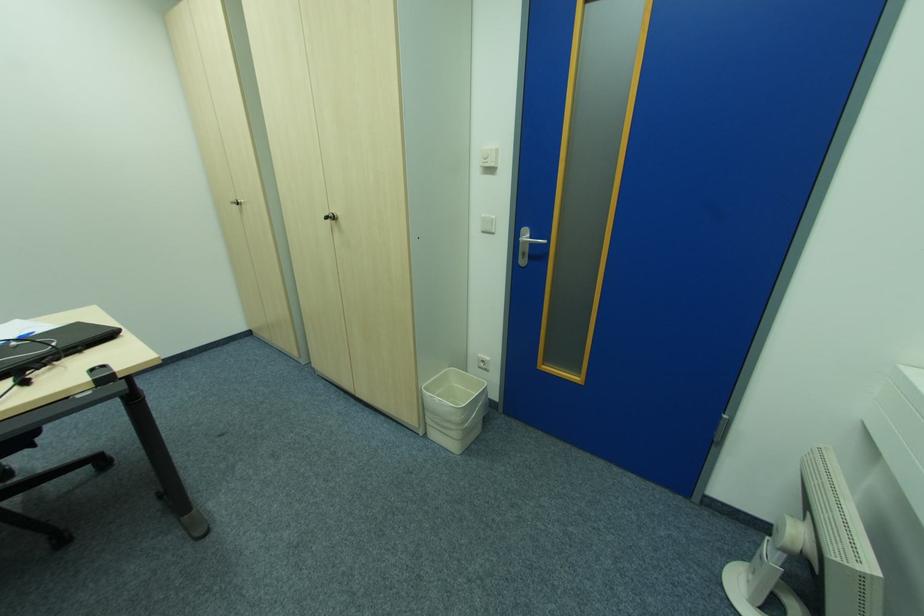
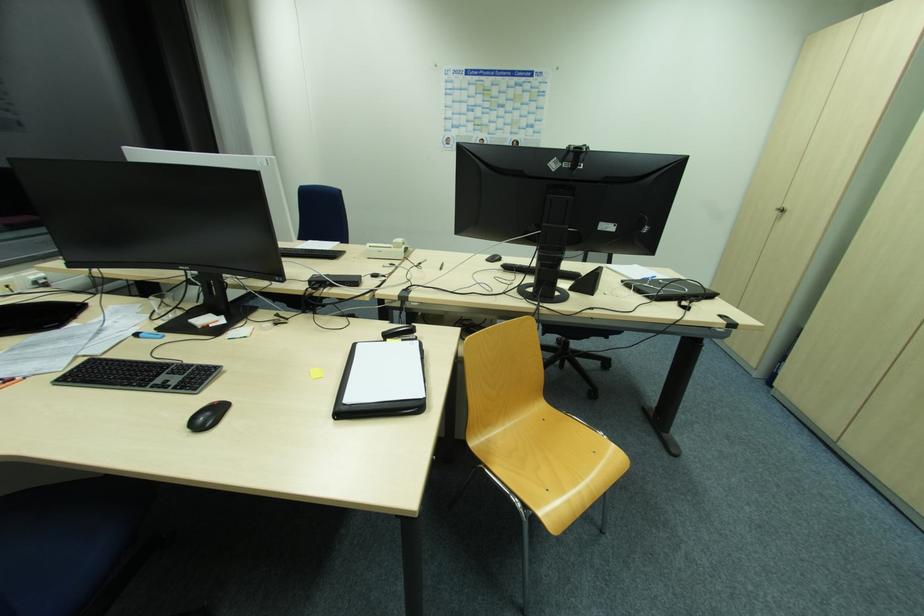
Question: The first image is from the beginning of the video and the second image is from the end. How did the camera likely rotate when shooting the video?

Choices:
 (A) Left
 (B) Right
 (C) Up
 (D) Down

Answer: (A)